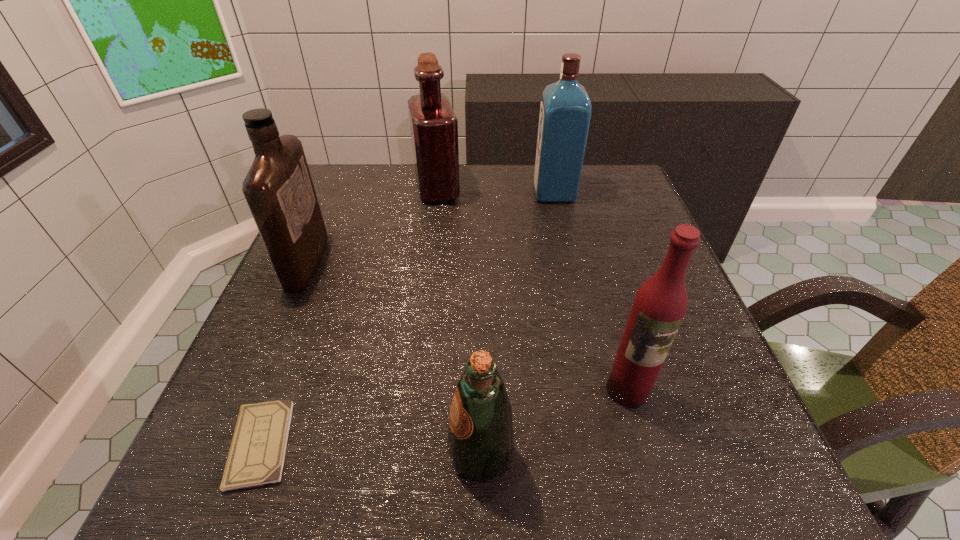
Locate an element on the screen. The image size is (960, 540). vacant space located on the front-facing side of the olive oil is located at coordinates (354, 454).

Image resolution: width=960 pixels, height=540 pixels. Find the location of `free region located on the front-facing side of the olive oil`. free region located on the front-facing side of the olive oil is located at coordinates (368, 454).

Locate an element on the screen. vacant space located on the back of the checkbook is located at coordinates (314, 304).

Locate an element on the screen. The height and width of the screenshot is (540, 960). olive oil that is at the near edge is located at coordinates (480, 439).

Where is `checkbook present at the near edge`? checkbook present at the near edge is located at coordinates (257, 453).

Where is `liquor that is at the left edge`? This screenshot has height=540, width=960. liquor that is at the left edge is located at coordinates (278, 188).

The height and width of the screenshot is (540, 960). Find the location of `checkbook that is positioned at the left edge`. checkbook that is positioned at the left edge is located at coordinates (257, 453).

Where is `object located at the right edge`? object located at the right edge is located at coordinates (660, 304).

You are a GUI agent. You are given a task and a screenshot of the screen. Output one action in this format:
    pyautogui.click(x=<x>, y=<y>)
    Task: Click on the object that is at the near left corner
    This screenshot has height=540, width=960.
    Given the screenshot: What is the action you would take?
    pyautogui.click(x=257, y=453)

You are a GUI agent. You are given a task and a screenshot of the screen. Output one action in this format:
    pyautogui.click(x=<x>, y=<y>)
    Task: Click on the vacant space at the left edge
    
    Given the screenshot: What is the action you would take?
    pyautogui.click(x=325, y=370)